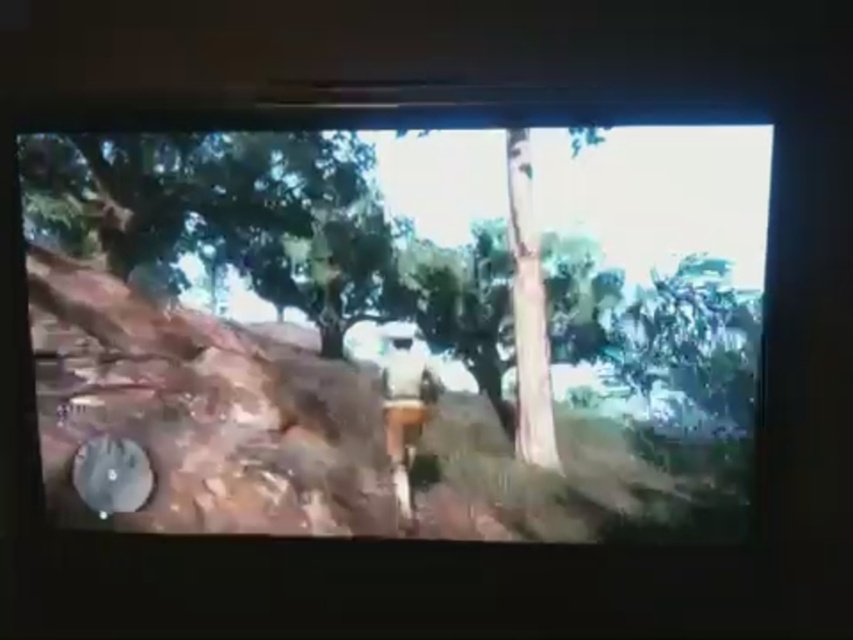
Which is below, matte white helmet at center or white matte shirt at center?

white matte shirt at center is below.

Is matte white helmet at center taller than white matte shirt at center?

Correct, matte white helmet at center is much taller as white matte shirt at center.

Which is behind, point (637, 269) or point (407, 420)?

Positioned behind is point (407, 420).

At what (x,y) coordinates should I click in order to perform the action: click on matte white helmet at center. Please return your answer as a coordinate pair (x, y). The height and width of the screenshot is (640, 853). Looking at the image, I should click on (399, 321).